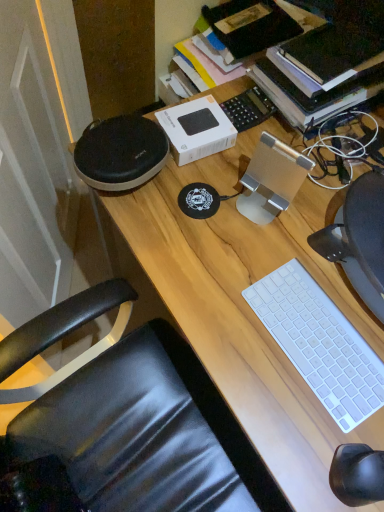
Find the location of a particular element. The height and width of the screenshot is (512, 384). free point in front of white plastic keyboard at lower right is located at coordinates (298, 426).